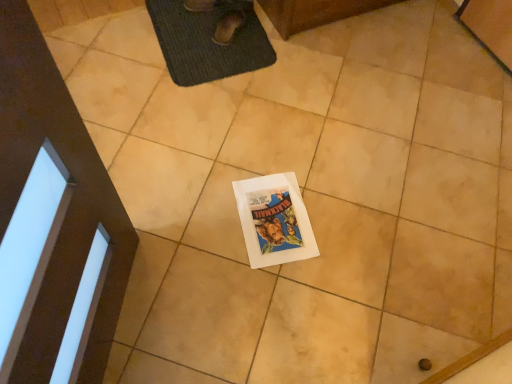
Where is `vacant space situated on the left part of brown suede shoe at upper center`? Image resolution: width=512 pixels, height=384 pixels. vacant space situated on the left part of brown suede shoe at upper center is located at coordinates (185, 24).